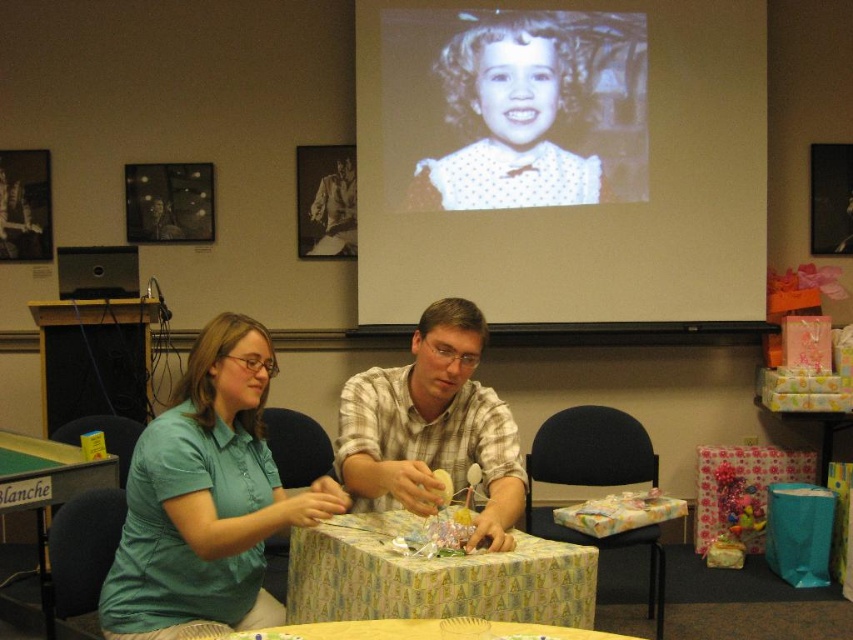
You are a guest at this gathering and want to place a small gift on the nearest table. Which table should you choose between the patterned paper table at center and the green fabric table at lower left?

The green fabric table at lower left is closer to you, so you should place the gift there.

You are standing in the room and want to place a gift on the closest table. Which table should you choose between the patterned paper table at center and the green fabric table at lower left?

The patterned paper table at center is closer to the viewer than the green fabric table at lower left, so you should choose the patterned paper table at center to place the gift.